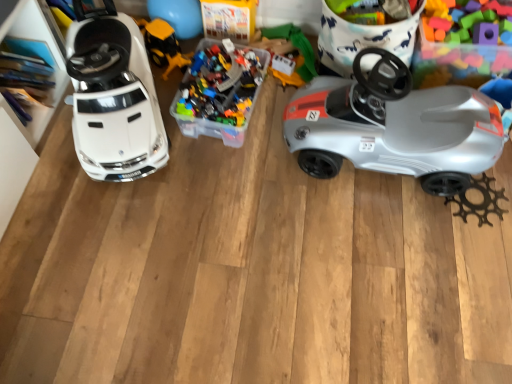
Question: Is translucent plastic container at center, positioned as the 3th toy in left-to-right order, positioned far away from silver plastic car at right?

Choices:
 (A) yes
 (B) no

Answer: (B)

Question: Is silver plastic car at right a part of translucent plastic container at center, positioned as the 3th toy in left-to-right order?

Choices:
 (A) yes
 (B) no

Answer: (B)

Question: From the image's perspective, would you say translucent plastic container at center, arranged as the 2th toy when viewed from the right, is positioned over silver plastic car at right?

Choices:
 (A) no
 (B) yes

Answer: (B)

Question: From a real-world perspective, is translucent plastic container at center, positioned as the 3th toy in left-to-right order, on top of silver plastic car at right?

Choices:
 (A) yes
 (B) no

Answer: (B)

Question: From the image's perspective, is translucent plastic container at center, positioned as the 3th toy in left-to-right order, under silver plastic car at right?

Choices:
 (A) yes
 (B) no

Answer: (B)

Question: Can you confirm if translucent plastic container at center, arranged as the 2th toy when viewed from the right, is wider than silver plastic car at right?

Choices:
 (A) no
 (B) yes

Answer: (B)

Question: Considering the relative sizes of translucent plastic blocks at upper right, positioned as the 1th toy in right-to-left order, and white glossy car at left, the 4th toy viewed from the right, in the image provided, is translucent plastic blocks at upper right, positioned as the 1th toy in right-to-left order, thinner than white glossy car at left, the 4th toy viewed from the right,?

Choices:
 (A) yes
 (B) no

Answer: (A)

Question: Is translucent plastic blocks at upper right, the fourth toy in the left-to-right sequence, facing towards white glossy car at left, the 4th toy viewed from the right?

Choices:
 (A) no
 (B) yes

Answer: (A)

Question: Is translucent plastic blocks at upper right, positioned as the 1th toy in right-to-left order, shorter than white glossy car at left, the 4th toy viewed from the right?

Choices:
 (A) no
 (B) yes

Answer: (B)

Question: Is translucent plastic blocks at upper right, positioned as the 1th toy in right-to-left order, at the left side of white glossy car at left, the 4th toy viewed from the right?

Choices:
 (A) no
 (B) yes

Answer: (A)

Question: Is translucent plastic blocks at upper right, positioned as the 1th toy in right-to-left order, positioned before white glossy car at left, the 1th toy from the left?

Choices:
 (A) no
 (B) yes

Answer: (A)

Question: Is translucent plastic blocks at upper right, positioned as the 1th toy in right-to-left order, to the right of white glossy car at left, the 1th toy from the left, from the viewer's perspective?

Choices:
 (A) no
 (B) yes

Answer: (B)

Question: Is translucent plastic container at center, positioned as the 3th toy in left-to-right order, at the left side of yellow plastic construction vehicle at center, positioned as the third toy in right-to-left order?

Choices:
 (A) yes
 (B) no

Answer: (B)